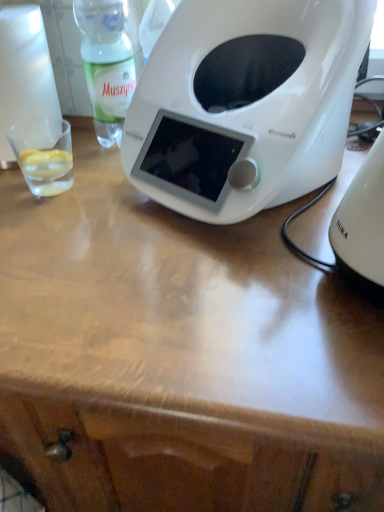
Question: Is green translucent bottle at upper left oriented towards white plastic kettle at right?

Choices:
 (A) yes
 (B) no

Answer: (B)

Question: Is green translucent bottle at upper left positioned behind white plastic kettle at right?

Choices:
 (A) no
 (B) yes

Answer: (B)

Question: Can you confirm if green translucent bottle at upper left is positioned to the right of white plastic kettle at right?

Choices:
 (A) no
 (B) yes

Answer: (A)

Question: Is green translucent bottle at upper left with white plastic kettle at right?

Choices:
 (A) no
 (B) yes

Answer: (A)

Question: Can white plastic kettle at right be found inside green translucent bottle at upper left?

Choices:
 (A) yes
 (B) no

Answer: (B)

Question: Can you confirm if green translucent bottle at upper left is wider than white plastic kettle at right?

Choices:
 (A) no
 (B) yes

Answer: (A)

Question: Is transparent glass at left completely or partially inside white paper towel at left?

Choices:
 (A) yes
 (B) no

Answer: (B)

Question: Is white paper towel at left smaller than transparent glass at left?

Choices:
 (A) yes
 (B) no

Answer: (B)

Question: From the image's perspective, does white paper towel at left appear lower than transparent glass at left?

Choices:
 (A) yes
 (B) no

Answer: (B)

Question: Considering the relative sizes of white paper towel at left and transparent glass at left in the image provided, is white paper towel at left bigger than transparent glass at left?

Choices:
 (A) yes
 (B) no

Answer: (A)

Question: Does white paper towel at left turn towards transparent glass at left?

Choices:
 (A) no
 (B) yes

Answer: (A)

Question: Can you confirm if white paper towel at left is positioned to the right of transparent glass at left?

Choices:
 (A) no
 (B) yes

Answer: (A)

Question: Considering the relative sizes of green translucent bottle at upper left and white paper towel at left in the image provided, is green translucent bottle at upper left smaller than white paper towel at left?

Choices:
 (A) no
 (B) yes

Answer: (B)